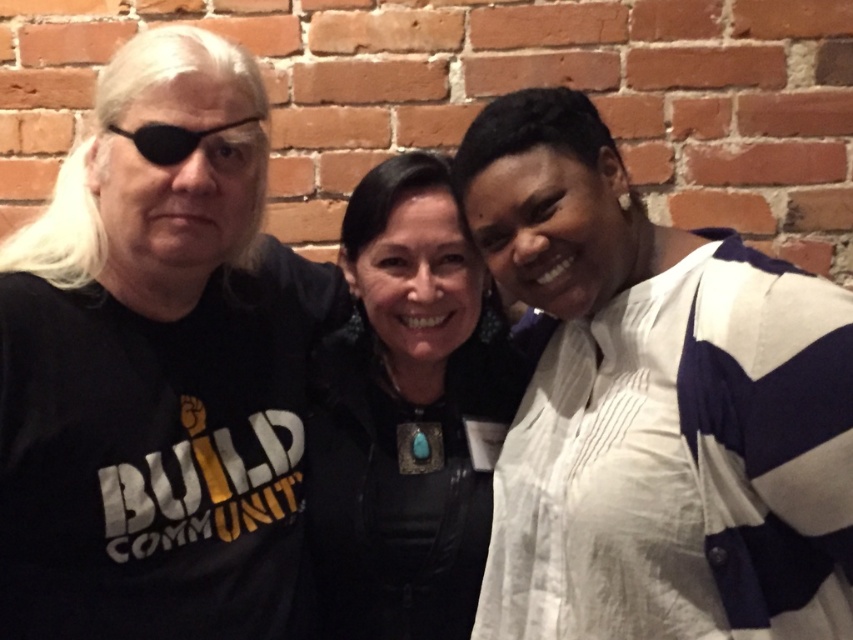
Question: Does black matte t-shirt at left have a smaller size compared to black plastic eyepatch at left?

Choices:
 (A) yes
 (B) no

Answer: (B)

Question: Can you confirm if black matte t-shirt at left is smaller than black leather jacket at center?

Choices:
 (A) no
 (B) yes

Answer: (A)

Question: Which point is closer to the camera?

Choices:
 (A) black plastic eyepatch at left
 (B) black matte t-shirt at left
 (C) black leather jacket at center

Answer: (B)

Question: In this image, where is black matte t-shirt at left located relative to black leather jacket at center?

Choices:
 (A) left
 (B) right

Answer: (A)

Question: Estimate the real-world distances between objects in this image. Which object is farther from the black matte t-shirt at left?

Choices:
 (A) black plastic eyepatch at left
 (B) black leather jacket at center

Answer: (A)

Question: Which point is closer to the camera?

Choices:
 (A) black plastic eyepatch at left
 (B) black matte t-shirt at left
 (C) black leather jacket at center

Answer: (B)